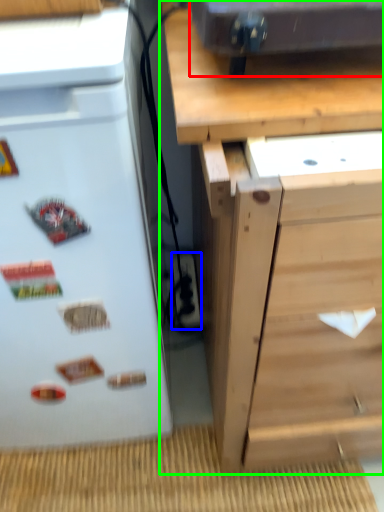
Question: Which object is the closest to the appliance (highlighted by a red box)? Choose among these: electric outlet (highlighted by a blue box) or chest of drawers (highlighted by a green box).

Choices:
 (A) electric outlet
 (B) chest of drawers

Answer: (B)